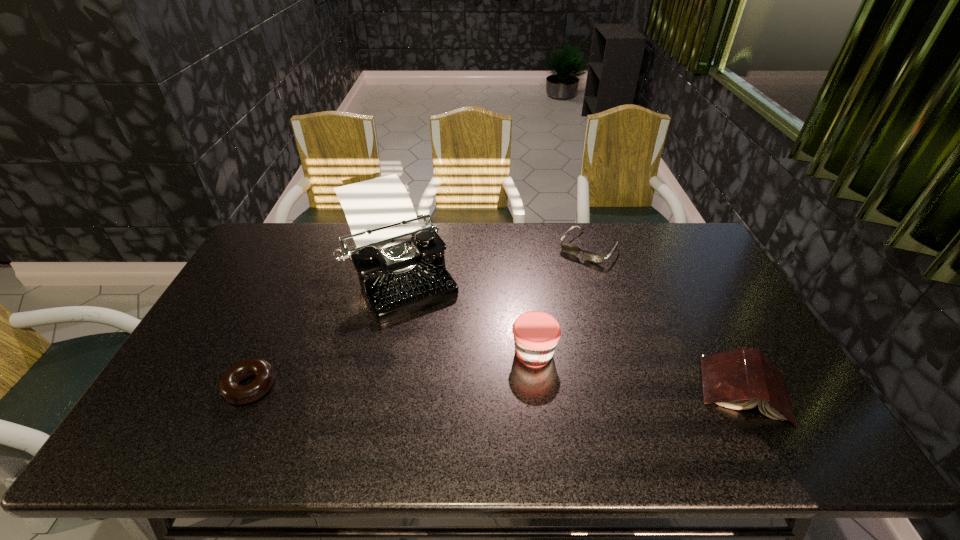
Locate an element on the screen. This screenshot has height=540, width=960. sunglasses present at the far edge is located at coordinates (569, 248).

Identify the location of doughnut present at the near edge. (229, 387).

Image resolution: width=960 pixels, height=540 pixels. Find the location of `book that is at the near edge`. book that is at the near edge is located at coordinates (739, 379).

You are a GUI agent. You are given a task and a screenshot of the screen. Output one action in this format:
    pyautogui.click(x=<x>, y=<y>)
    Task: Click on the object at the left edge
    
    Given the screenshot: What is the action you would take?
    pyautogui.click(x=229, y=387)

Where is `object that is at the right edge`? This screenshot has width=960, height=540. object that is at the right edge is located at coordinates (739, 379).

Find the location of a particular element. The height and width of the screenshot is (540, 960). object that is positioned at the near left corner is located at coordinates (229, 387).

This screenshot has height=540, width=960. I want to click on object that is at the near right corner, so click(739, 379).

Locate an element on the screen. The height and width of the screenshot is (540, 960). vacant space at the far edge is located at coordinates (332, 244).

I want to click on vacant region at the near edge of the desktop, so click(x=608, y=417).

Identify the location of vacant space at the far left corner of the desktop. (289, 232).